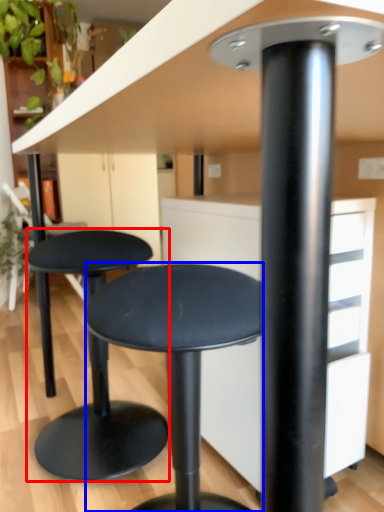
Question: Which of the following is the farthest to the observer, stool (highlighted by a red box) or stool (highlighted by a blue box)?

Choices:
 (A) stool
 (B) stool

Answer: (A)